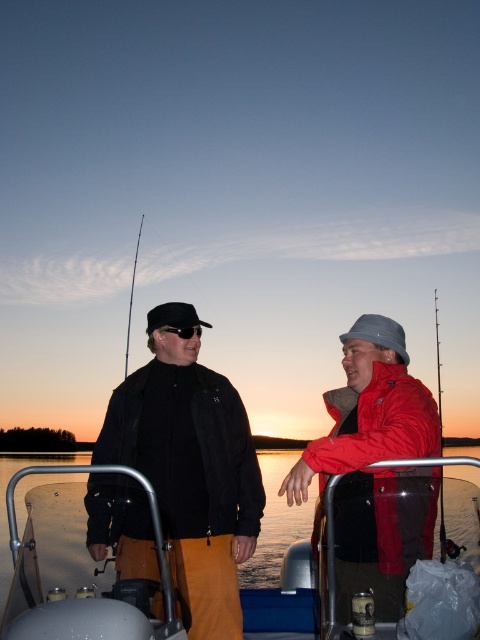
Question: Observing the image, what is the correct spatial positioning of black matte jacket at center in reference to red matte jacket at right?

Choices:
 (A) below
 (B) above

Answer: (A)

Question: Can you confirm if black matte jacket at center is thinner than metallic fishing pole at right?

Choices:
 (A) no
 (B) yes

Answer: (B)

Question: Which of the following is the farthest from the observer?

Choices:
 (A) (186, 326)
 (B) (410, 452)
 (C) (116, 397)

Answer: (A)

Question: Estimate the real-world distances between objects in this image. Which object is farther from the black matte jacket at center?

Choices:
 (A) metallic gray boat at center
 (B) red matte jacket at right

Answer: (A)

Question: Which point is closer to the camera?

Choices:
 (A) metallic gray boat at center
 (B) black matte goggles at center

Answer: (A)

Question: Does red matte jacket at right appear under black matte goggles at center?

Choices:
 (A) no
 (B) yes

Answer: (B)